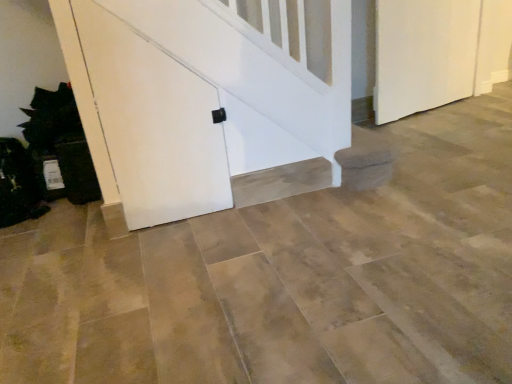
Question: In which direction should I rotate to look at white matte door at center, arranged as the 1th door when viewed from the left?

Choices:
 (A) left
 (B) right

Answer: (A)

Question: Is white matte door at center, arranged as the 1th door when viewed from the left, completely or partially outside of white matte door at right, the 1th door viewed from the right?

Choices:
 (A) no
 (B) yes

Answer: (B)

Question: Can you confirm if white matte door at center, acting as the 2th door starting from the back, is smaller than white matte door at right, the second door in the front-to-back sequence?

Choices:
 (A) no
 (B) yes

Answer: (B)

Question: From the image's perspective, is white matte door at center, arranged as the 1th door when viewed from the front, below white matte door at right, the first door positioned from the back?

Choices:
 (A) yes
 (B) no

Answer: (A)

Question: Is white matte door at center, arranged as the 1th door when viewed from the front, far away from white matte door at right, the second door in the front-to-back sequence?

Choices:
 (A) yes
 (B) no

Answer: (A)

Question: Can you confirm if white matte door at center, arranged as the 1th door when viewed from the front, is thinner than white matte door at right, the first door positioned from the back?

Choices:
 (A) no
 (B) yes

Answer: (B)

Question: Is white matte door at center, arranged as the 1th door when viewed from the front, to the right of white matte door at right, the first door positioned from the back, from the viewer's perspective?

Choices:
 (A) yes
 (B) no

Answer: (B)

Question: Can you confirm if white matte door at right, the first door positioned from the back, is bigger than white matte door at center, acting as the 2th door starting from the back?

Choices:
 (A) yes
 (B) no

Answer: (A)

Question: Could white matte door at center, arranged as the 1th door when viewed from the front, be considered to be inside white matte door at right, the second door in the front-to-back sequence?

Choices:
 (A) yes
 (B) no

Answer: (B)

Question: Can you confirm if white matte door at right, the 1th door viewed from the right, is thinner than white matte door at center, acting as the 2th door starting from the back?

Choices:
 (A) yes
 (B) no

Answer: (B)

Question: Is white matte door at right, the second door in the front-to-back sequence, wider than white matte door at center, placed as the 2th door when sorted from right to left?

Choices:
 (A) yes
 (B) no

Answer: (A)

Question: Is white matte door at right, which is counted as the 2th door, starting from the left, smaller than white matte door at center, arranged as the 1th door when viewed from the left?

Choices:
 (A) yes
 (B) no

Answer: (B)

Question: From a real-world perspective, does white matte door at right, which is counted as the 2th door, starting from the left, sit lower than white matte door at center, acting as the 2th door starting from the back?

Choices:
 (A) no
 (B) yes

Answer: (B)

Question: Based on their sizes in the image, would you say white matte door at right, which is counted as the 2th door, starting from the left, is bigger or smaller than white matte door at center, arranged as the 1th door when viewed from the left?

Choices:
 (A) small
 (B) big

Answer: (B)